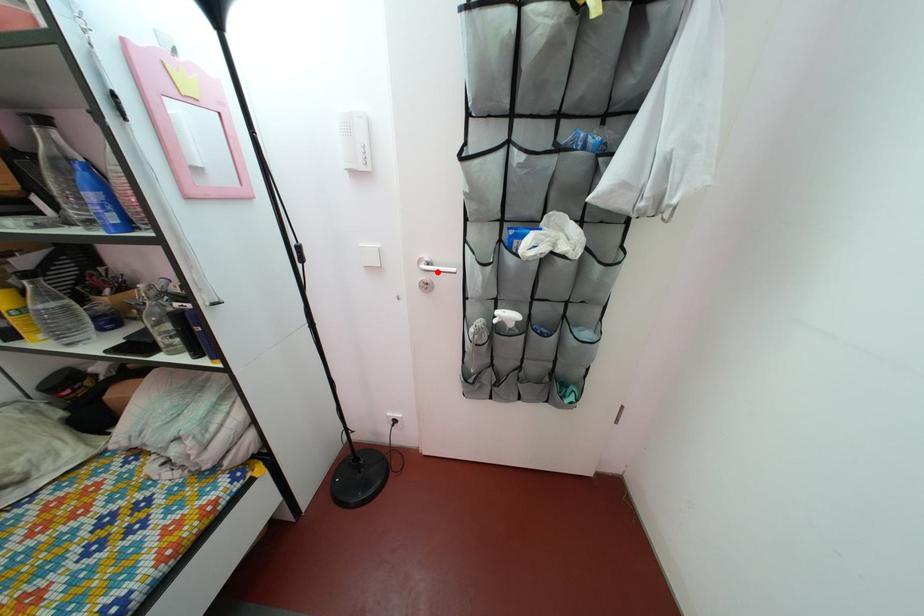
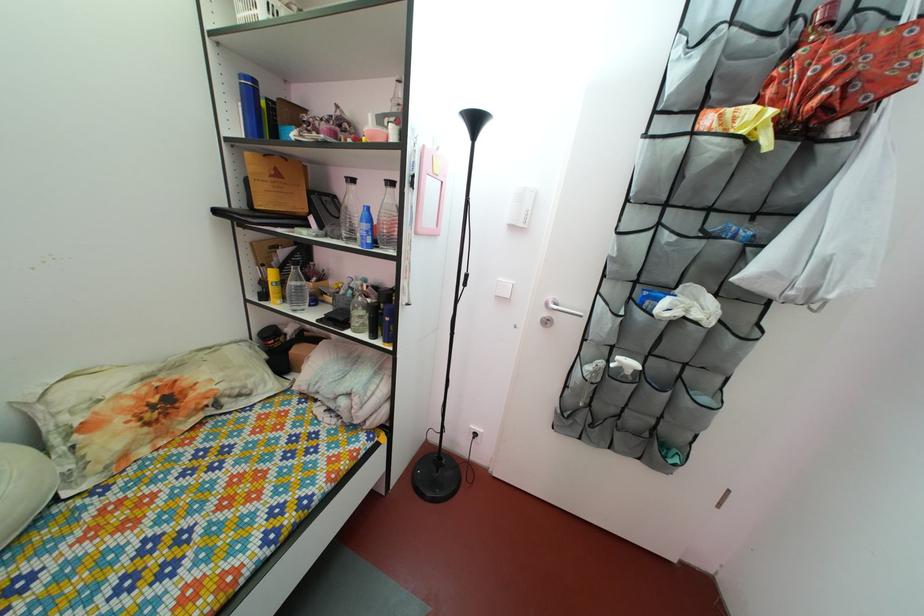
Find the pixel in the second image that matches the highlighted location in the first image.

(565, 313)